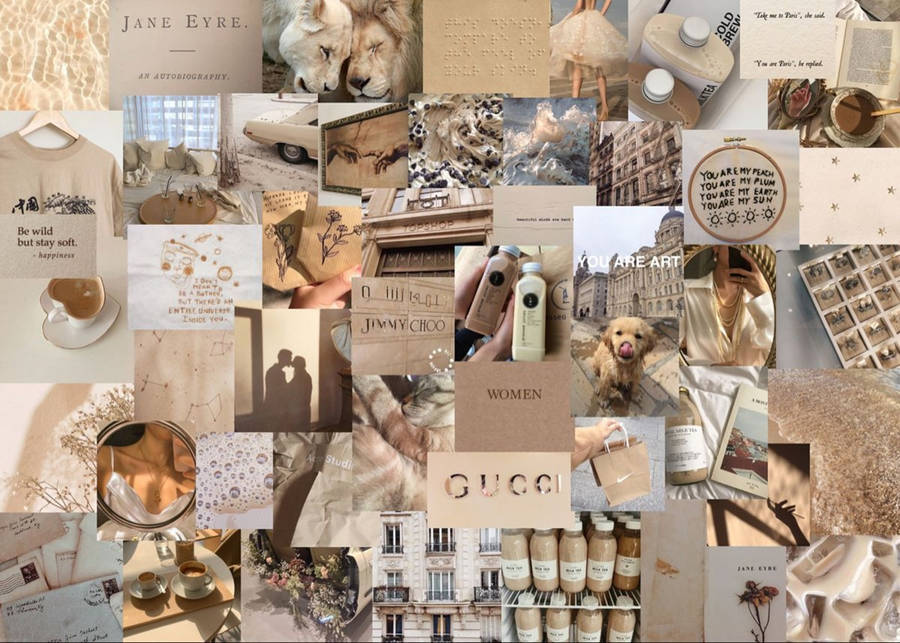
I want to click on pillows, so click(207, 166), click(192, 167), click(183, 157), click(155, 152), click(130, 158).